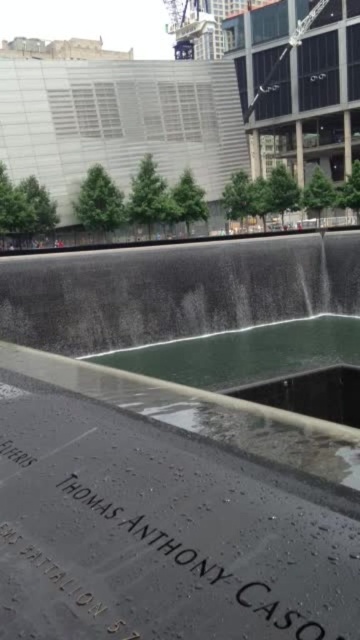
Between green polished stone fountain at center and black polished stone at center, which one appears on the right side from the viewer's perspective?

black polished stone at center

Does point (141, 582) come in front of point (294, 497)?

Yes, point (141, 582) is in front of point (294, 497).

Image resolution: width=360 pixels, height=640 pixels. Find the location of `green polished stone fountain at center`. green polished stone fountain at center is located at coordinates (176, 445).

Identify the location of green polished stone fountain at center. Image resolution: width=360 pixels, height=640 pixels. (176, 445).